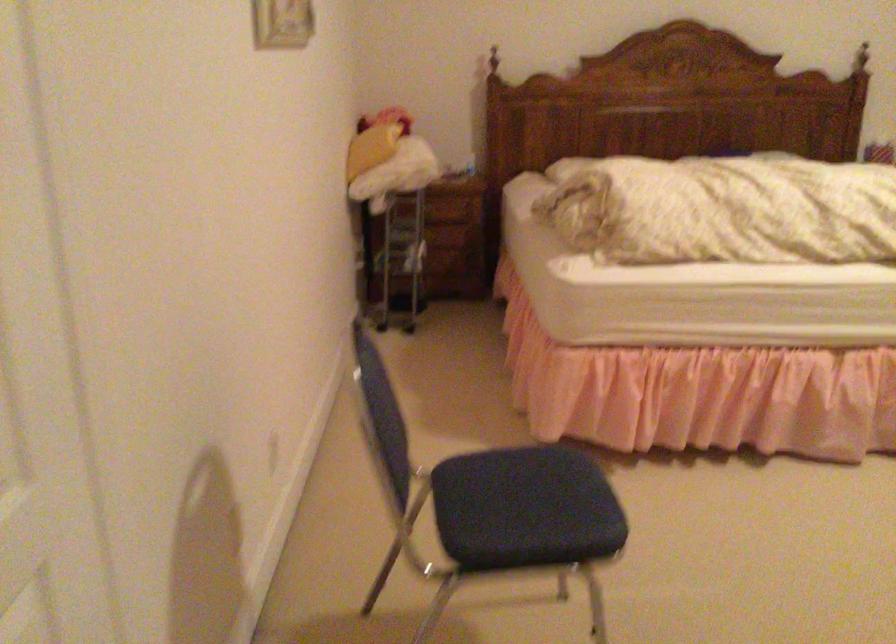
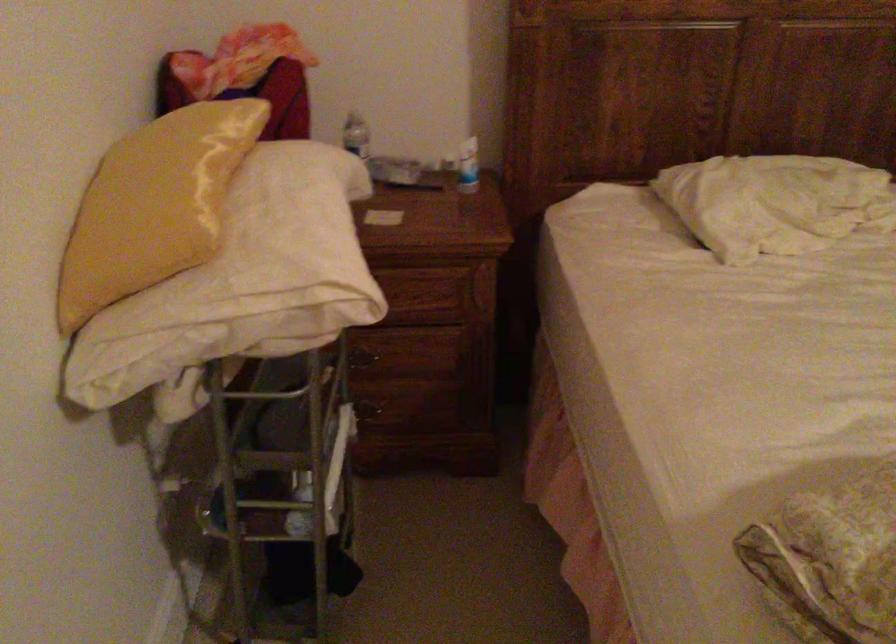
Where in the second image is the point corresponding to [368,136] from the first image?

(153, 205)